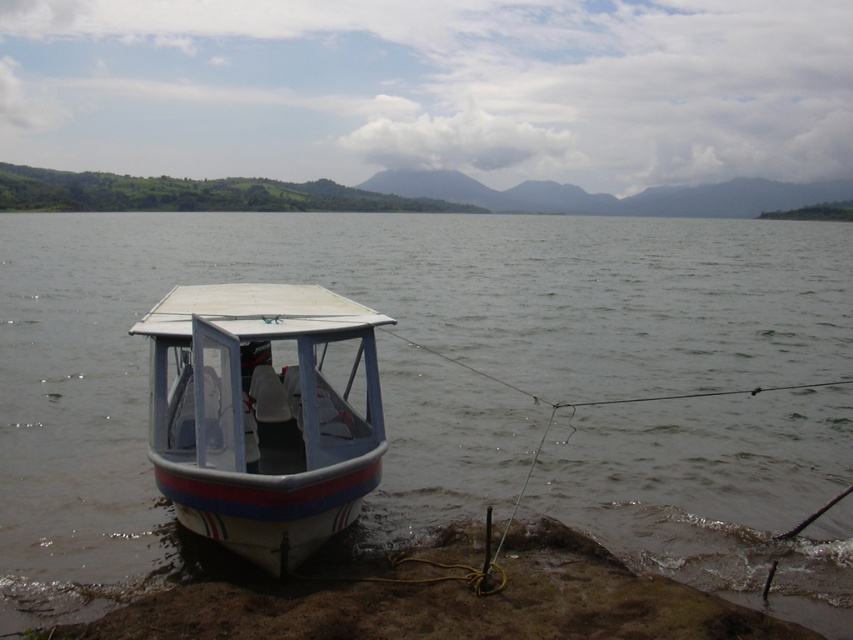
Question: Observing the image, what is the correct spatial positioning of clear water at boat left in reference to white matte boat at center?

Choices:
 (A) right
 (B) left

Answer: (A)

Question: Is white matte boat at center bigger than muddy sand at lower left?

Choices:
 (A) yes
 (B) no

Answer: (A)

Question: Does clear water at boat left appear on the right side of white matte boat at center?

Choices:
 (A) yes
 (B) no

Answer: (A)

Question: Based on their relative distances, which object is nearer to the muddy sand at lower left?

Choices:
 (A) clear water at boat left
 (B) white matte boat at center

Answer: (B)

Question: Which point appears closest to the camera in this image?

Choices:
 (A) (366, 253)
 (B) (177, 504)

Answer: (B)

Question: Among these objects, which one is nearest to the camera?

Choices:
 (A) clear water at boat left
 (B) white matte boat at center

Answer: (B)